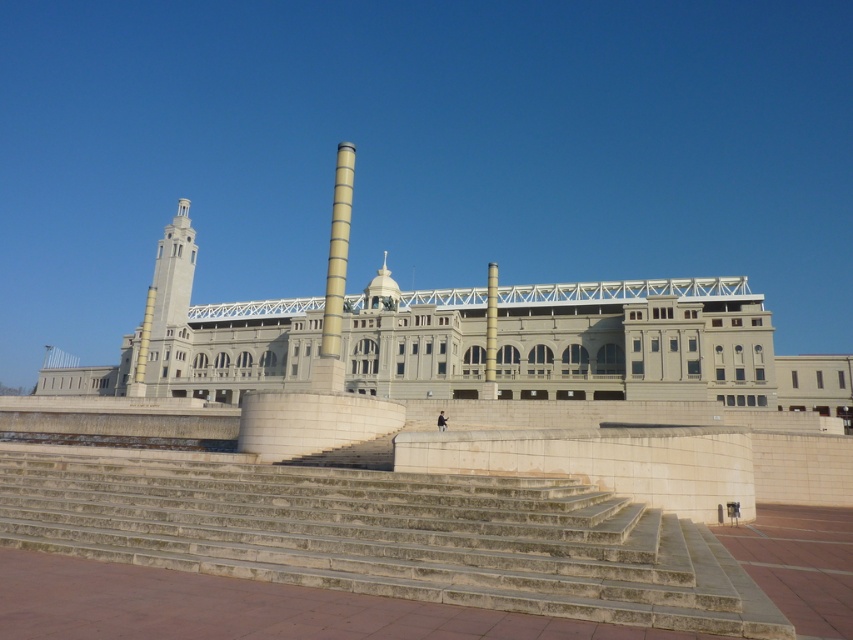
Question: Is gray stone building at center positioned before yellow concrete pillar at center?

Choices:
 (A) no
 (B) yes

Answer: (A)

Question: Can you confirm if stone steps at center is positioned above gray stone building at center?

Choices:
 (A) no
 (B) yes

Answer: (A)

Question: Which object is positioned farthest from the stone steps at center?

Choices:
 (A) yellow concrete pillar at center
 (B) gray stone building at center

Answer: (B)

Question: Among these objects, which one is farthest from the camera?

Choices:
 (A) yellow concrete pillar at center
 (B) stone steps at center
 (C) gray stone building at center

Answer: (C)

Question: Can you confirm if stone steps at center is smaller than gray stone building at center?

Choices:
 (A) yes
 (B) no

Answer: (A)

Question: Which is nearer to the stone steps at center?

Choices:
 (A) gray stone building at center
 (B) yellow concrete pillar at center

Answer: (B)